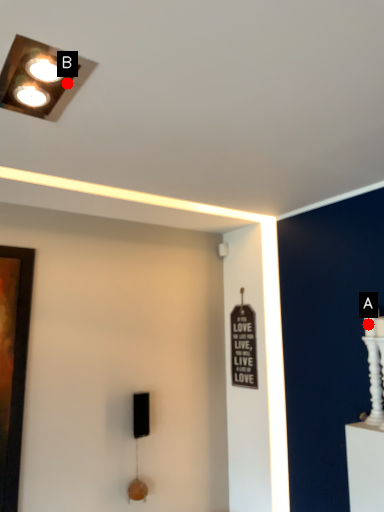
Question: Two points are circled on the image, labeled by A and B beside each circle. Among these points, which one is nearest to the camera?

Choices:
 (A) A is closer
 (B) B is closer

Answer: (B)